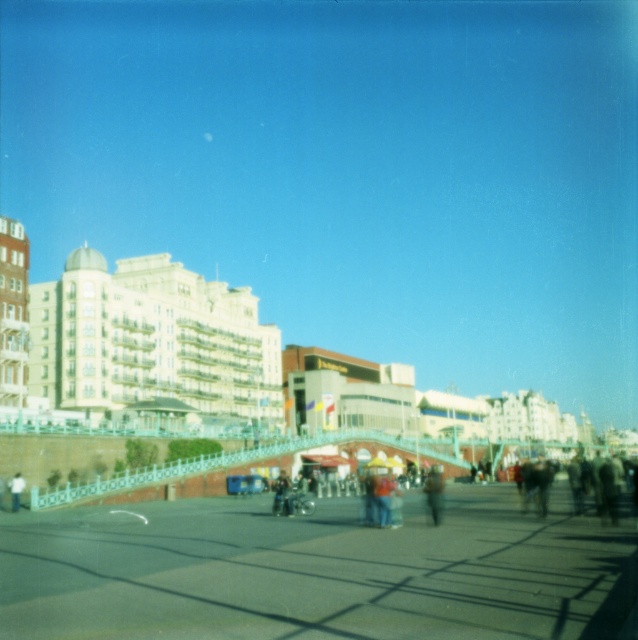
This screenshot has height=640, width=638. What do you see at coordinates (383, 497) in the screenshot?
I see `denim pants at center` at bounding box center [383, 497].

Does point (383, 474) come in front of point (429, 504)?

That is False.

Who is more forward, (382, 502) or (424, 490)?

Point (382, 502) is more forward.

The image size is (638, 640). I want to click on denim pants at center, so click(383, 497).

Is teal painted metal pedestrian bridge at center to the right of brown fuzzy coat at center from the viewer's perspective?

Indeed, teal painted metal pedestrian bridge at center is positioned on the right side of brown fuzzy coat at center.

Based on the photo, is teal painted metal pedestrian bridge at center to the left of brown fuzzy coat at center from the viewer's perspective?

No, teal painted metal pedestrian bridge at center is not to the left of brown fuzzy coat at center.

Describe the element at coordinates (241, 464) in the screenshot. I see `teal painted metal pedestrian bridge at center` at that location.

Where is `teal painted metal pedestrian bridge at center`? The image size is (638, 640). teal painted metal pedestrian bridge at center is located at coordinates (241, 464).

Does denim pants at center appear under dark gray concrete person at center?

Yes, denim pants at center is below dark gray concrete person at center.

Does point (380, 496) come closer to viewer compared to point (15, 480)?

Yes, point (380, 496) is closer to viewer.

Is point (389, 504) less distant than point (13, 490)?

Yes, it is in front of point (13, 490).

You are a GUI agent. You are given a task and a screenshot of the screen. Output one action in this format:
    pyautogui.click(x=<x>, y=<y>)
    Task: Click on the denim pants at center
    
    Given the screenshot: What is the action you would take?
    pyautogui.click(x=383, y=497)